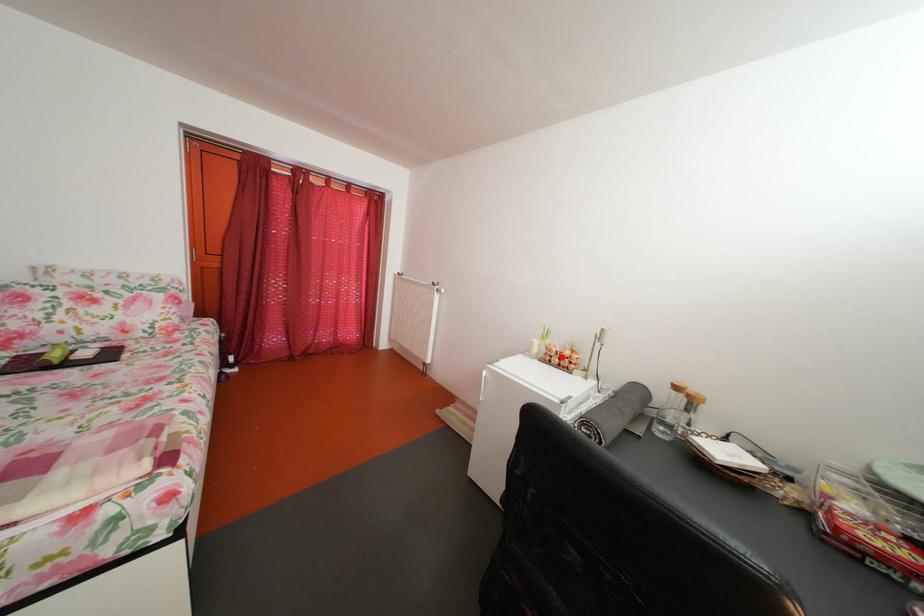
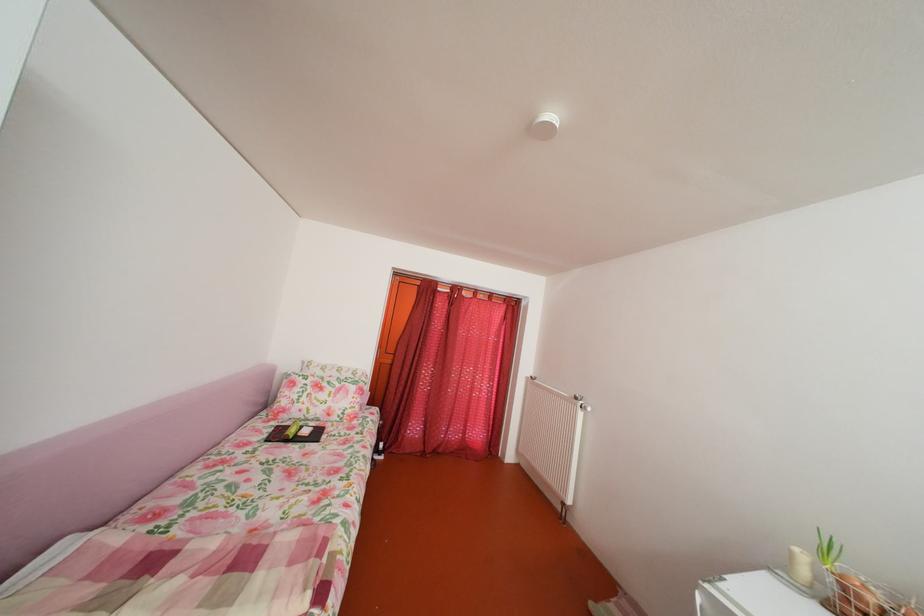
Question: A red point is marked in image1. In image2, is the corresponding 3D point closer to the camera or farther? Reply with the corresponding letter.

Choices:
 (A) The corresponding 3D point is closer.
 (B) The corresponding 3D point is farther.

Answer: (A)